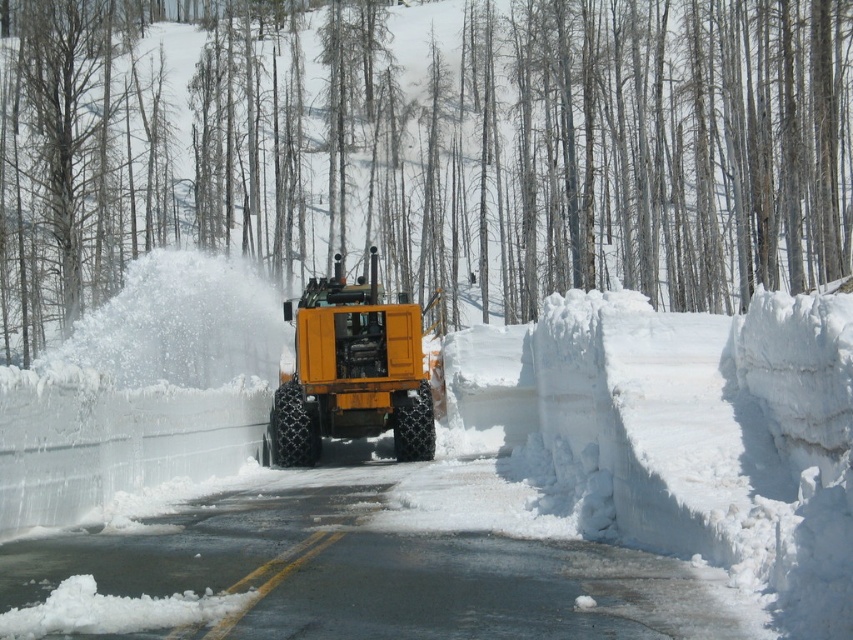
Question: Does white fluffy snow at center come behind yellow rubber tire at center?

Choices:
 (A) yes
 (B) no

Answer: (B)

Question: Does white fluffy snow at center have a smaller size compared to yellow rubber tire at center?

Choices:
 (A) no
 (B) yes

Answer: (A)

Question: Is white fluffy snow at center closer to camera compared to yellow rubber tire at center?

Choices:
 (A) no
 (B) yes

Answer: (B)

Question: Which point is farther to the camera?

Choices:
 (A) (741, 342)
 (B) (440, 104)

Answer: (B)

Question: Which of the following is the farthest from the observer?

Choices:
 (A) smooth snow at center
 (B) white fluffy snow at center
 (C) yellow rubber tire at center

Answer: (A)

Question: Which object is farther from the camera taking this photo?

Choices:
 (A) white fluffy snow at center
 (B) smooth snow at center
 (C) yellow rubber tire at center

Answer: (B)